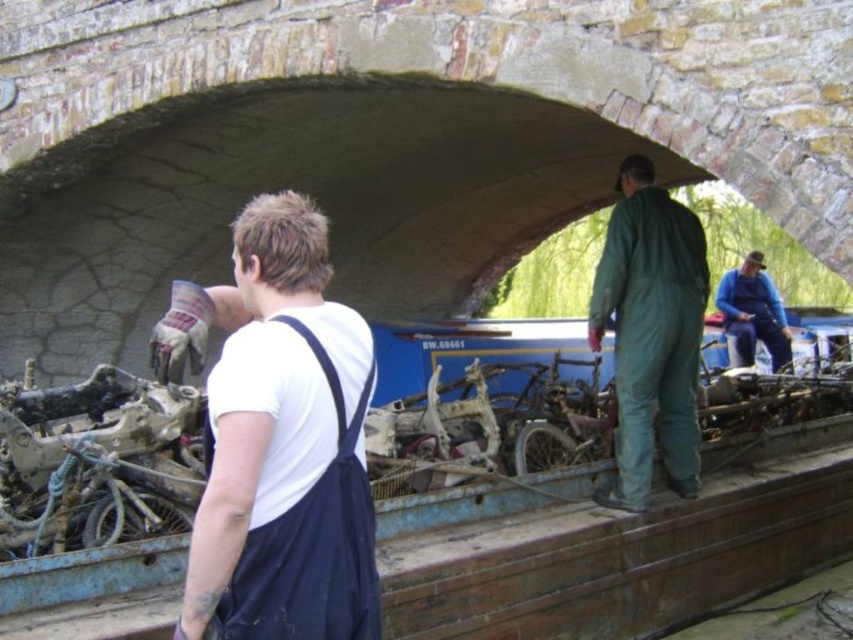
Is point (297, 308) positioned in front of point (730, 312)?

That is True.

Measure the distance between white matte shirt at center and blue denim overalls at center.

A distance of 36.09 meters exists between white matte shirt at center and blue denim overalls at center.

Find the location of a particular element. This screenshot has height=640, width=853. white matte shirt at center is located at coordinates (283, 449).

Which is more to the right, white matte shirt at center or green matte jumpsuit at center?

Positioned to the right is green matte jumpsuit at center.

Who is more forward, (318, 448) or (688, 388)?

Point (318, 448) is in front.

Is point (332, 410) in front of point (630, 460)?

That is True.

I want to click on white matte shirt at center, so coord(283,449).

Image resolution: width=853 pixels, height=640 pixels. I want to click on green matte jumpsuit at center, so click(651, 332).

Can you confirm if green matte jumpsuit at center is positioned below blue denim overalls at center?

Yes.

Does point (677, 348) lie in front of point (773, 355)?

That is True.

I want to click on green matte jumpsuit at center, so click(651, 332).